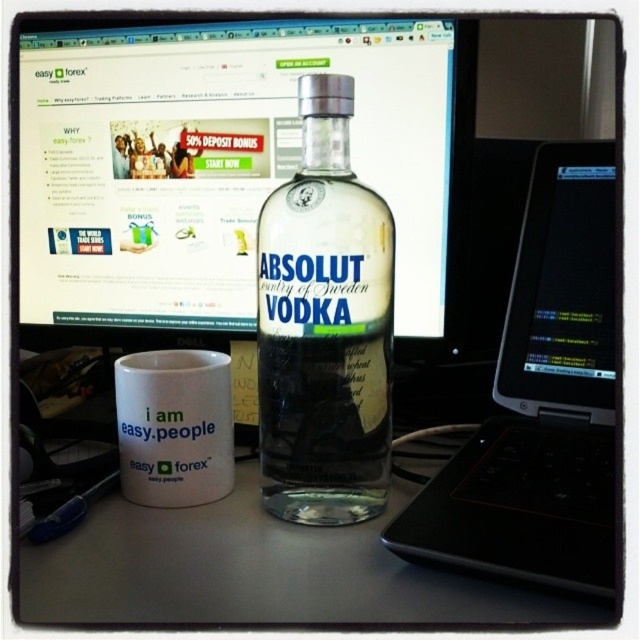
Question: Considering the relative positions of white matte table at lower center and white matte mug at lower left in the image provided, where is white matte table at lower center located with respect to white matte mug at lower left?

Choices:
 (A) right
 (B) left

Answer: (A)

Question: Which is nearer to the white matte table at lower center?

Choices:
 (A) transparent glass monitor at center
 (B) clear glass bottle at center
 (C) white matte mug at lower left
 (D) black plastic laptop at center

Answer: (C)

Question: Which object appears farthest from the camera in this image?

Choices:
 (A) transparent glass monitor at center
 (B) clear glass bottle at center
 (C) black plastic laptop at center

Answer: (B)

Question: Which point is closer to the camera?

Choices:
 (A) white matte table at lower center
 (B) clear glass bottle at center
 (C) transparent glass monitor at center
 (D) white matte mug at lower left

Answer: (A)

Question: Can you confirm if clear glass bottle at center is positioned below white matte mug at lower left?

Choices:
 (A) yes
 (B) no

Answer: (B)

Question: Can you confirm if white matte table at lower center is thinner than clear glass bottle at center?

Choices:
 (A) yes
 (B) no

Answer: (B)